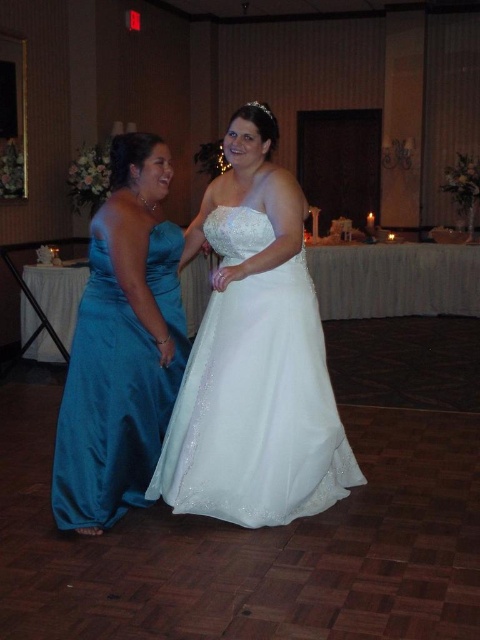
Question: Which point is farther to the camera?

Choices:
 (A) teal satin dress at left
 (B) white satin dress at center

Answer: (A)

Question: Does white satin dress at center appear over teal satin dress at left?

Choices:
 (A) no
 (B) yes

Answer: (B)

Question: Can you confirm if white satin dress at center is wider than teal satin dress at left?

Choices:
 (A) no
 (B) yes

Answer: (B)

Question: In this image, where is white satin dress at center located relative to teal satin dress at left?

Choices:
 (A) above
 (B) below

Answer: (A)